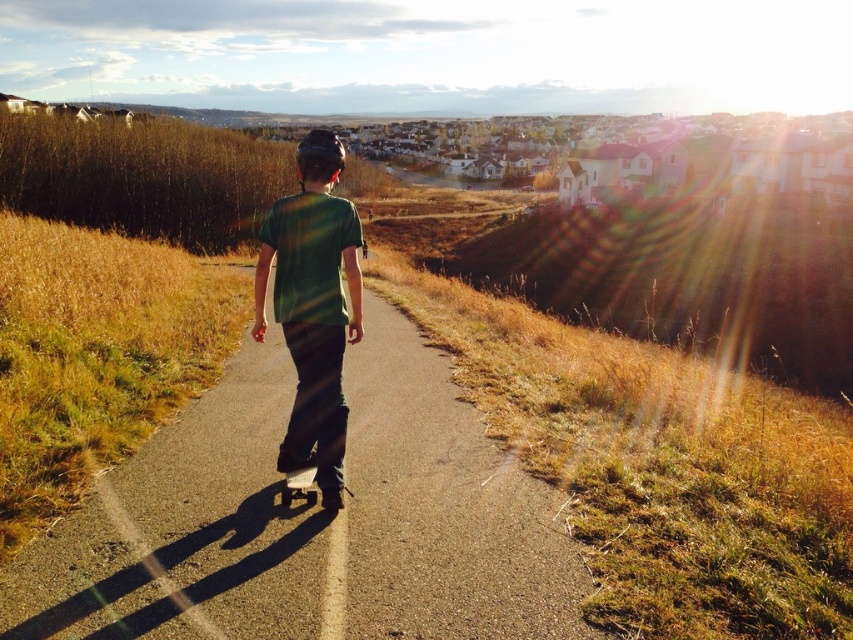
Question: Among these objects, which one is farthest from the camera?

Choices:
 (A) smooth asphalt road at center
 (B) black matte skateboard at center

Answer: (B)

Question: Is smooth asphalt road at center above green matte shirt at center?

Choices:
 (A) yes
 (B) no

Answer: (B)

Question: Which point is farther to the camera?

Choices:
 (A) (207, 612)
 (B) (288, 493)

Answer: (B)

Question: Which is nearer to the green matte shirt at center?

Choices:
 (A) black matte skateboard at center
 (B) smooth asphalt road at center

Answer: (A)

Question: Does smooth asphalt road at center appear under green matte shirt at center?

Choices:
 (A) yes
 (B) no

Answer: (A)

Question: Can you confirm if green matte shirt at center is positioned to the left of black matte skateboard at center?

Choices:
 (A) no
 (B) yes

Answer: (B)